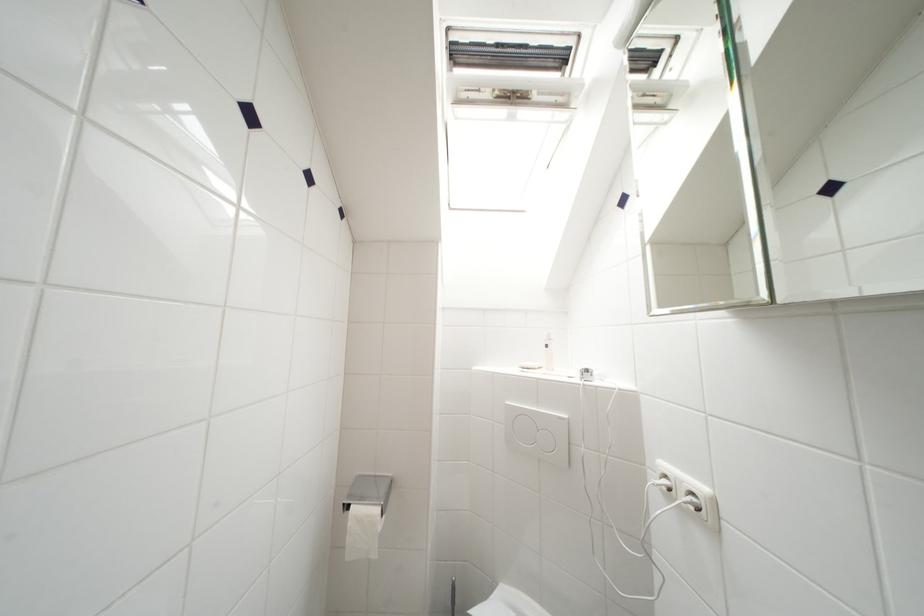
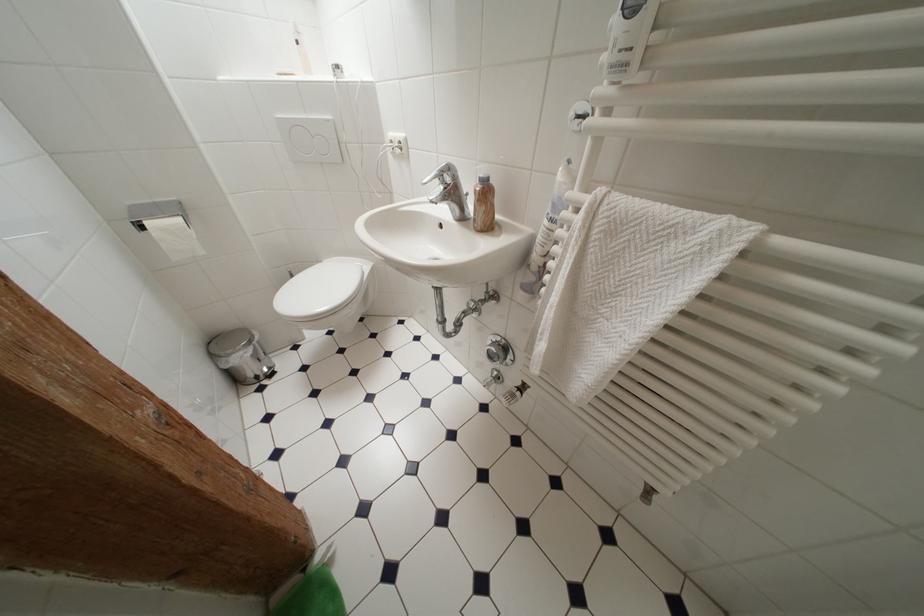
The point at [369,503] is marked in the first image. Where is the corresponding point in the second image?

(160, 219)